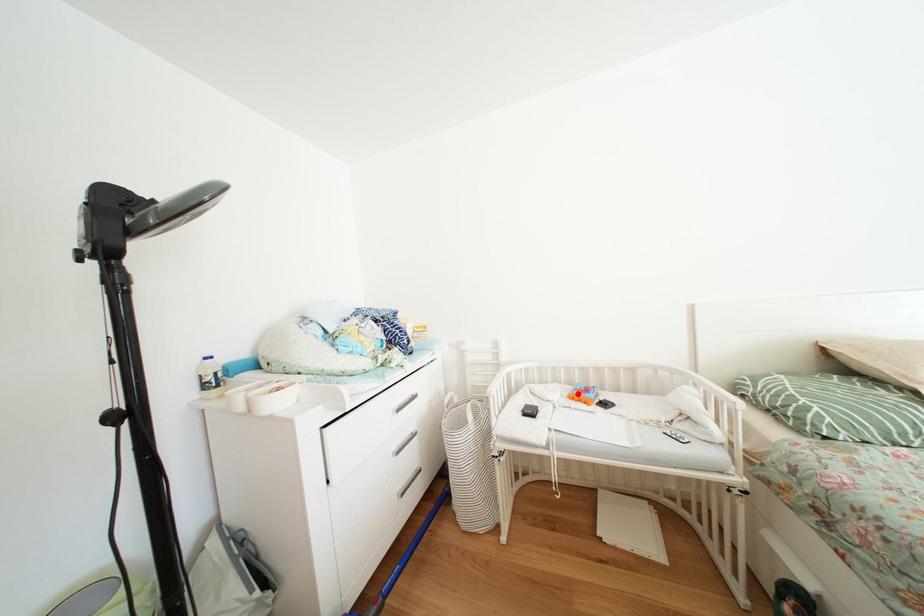
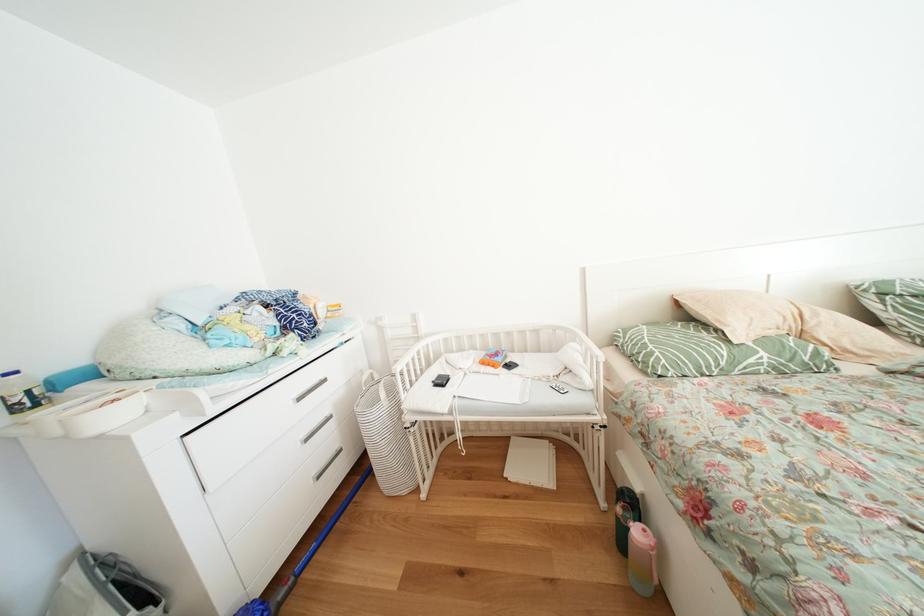
Locate, in the second image, the point that corresponds to the highlighted location in the first image.

(491, 360)